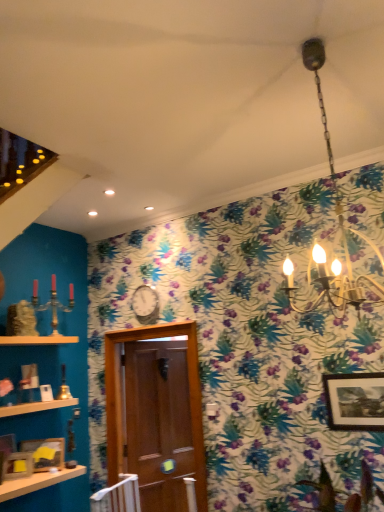
You are a GUI agent. You are given a task and a screenshot of the screen. Output one action in this format:
    pyautogui.click(x=<x>, y=<y>)
    Task: Click on the empty space that is ontop of brown wooden door at center (from a real-world perspective)
    This screenshot has height=512, width=384.
    Given the screenshot: What is the action you would take?
    pyautogui.click(x=143, y=327)